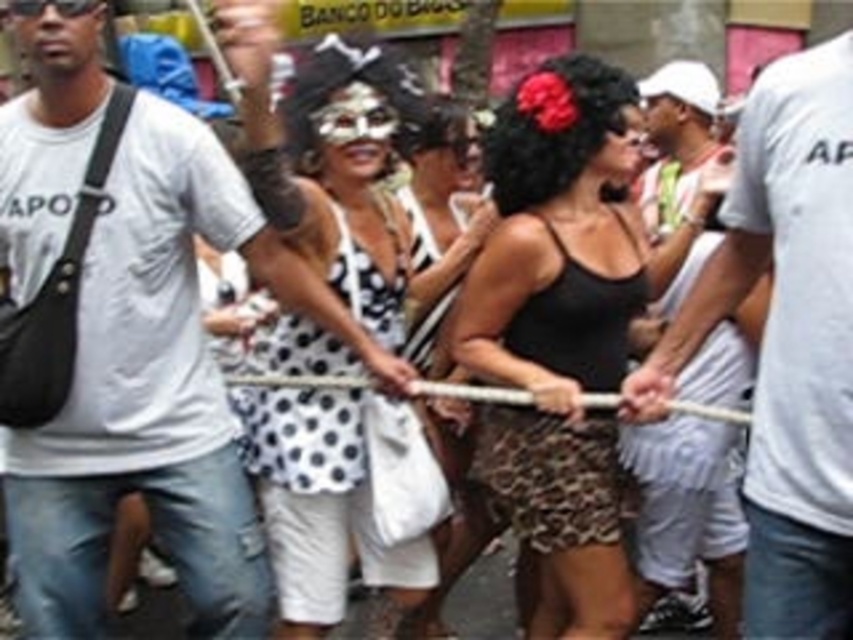
Can you confirm if white dotted dress at center is positioned below black satin dress at center?

No, white dotted dress at center is not below black satin dress at center.

Who is shorter, white dotted dress at center or black satin dress at center?

black satin dress at center

Is point (386, 593) more distant than point (461, 513)?

No, it is in front of (461, 513).

This screenshot has height=640, width=853. Find the location of `white dotted dress at center`. white dotted dress at center is located at coordinates (329, 182).

Between black matte tank top at center and black satin dress at center, which one has more height?

black satin dress at center

Which is more to the left, black matte tank top at center or black satin dress at center?

black satin dress at center

Which is in front, point (573, 470) or point (410, 304)?

Positioned in front is point (573, 470).

At what (x,y) coordinates should I click in order to perform the action: click on black matte tank top at center. Please return your answer as a coordinate pair (x, y). Looking at the image, I should click on (561, 330).

Does white dotted dress at center have a lesser width compared to white cotton shirt at center?

No, white dotted dress at center is not thinner than white cotton shirt at center.

What do you see at coordinates (329, 182) in the screenshot? The height and width of the screenshot is (640, 853). I see `white dotted dress at center` at bounding box center [329, 182].

Image resolution: width=853 pixels, height=640 pixels. In order to click on white dotted dress at center in this screenshot , I will do `click(329, 182)`.